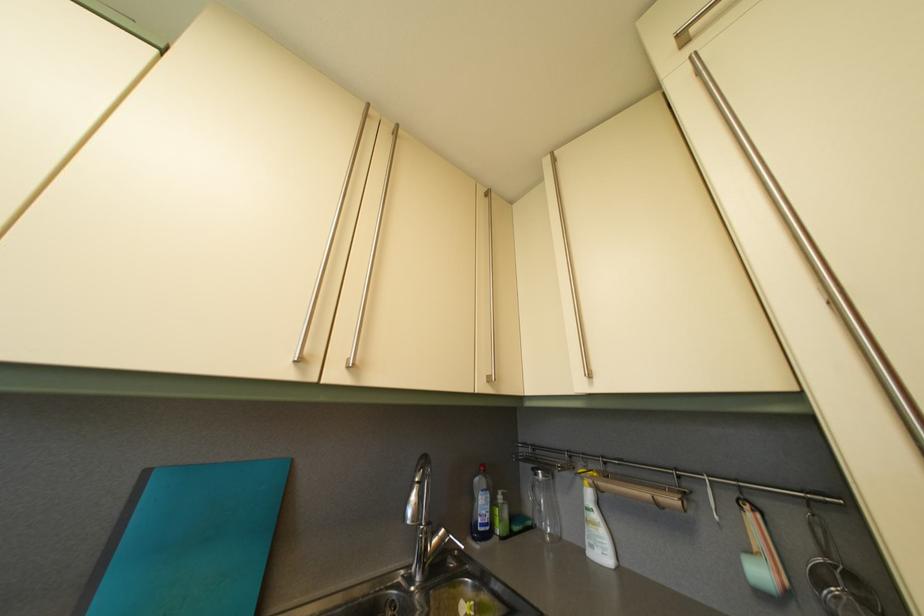
The height and width of the screenshot is (616, 924). What do you see at coordinates (482, 468) in the screenshot? I see `the blue bottle cap` at bounding box center [482, 468].